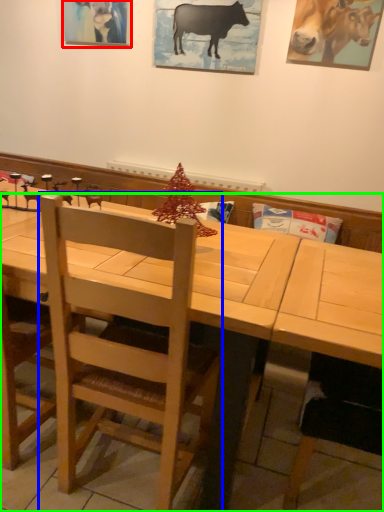
Question: Considering the real-world distances, which object is closest to picture frame (highlighted by a red box)? chair (highlighted by a blue box) or table (highlighted by a green box).

Choices:
 (A) chair
 (B) table

Answer: (B)